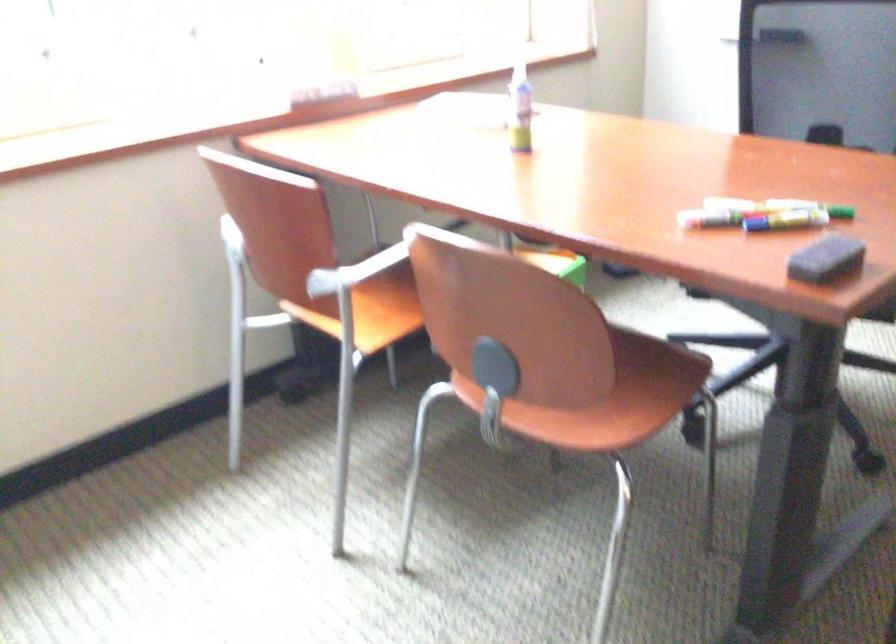
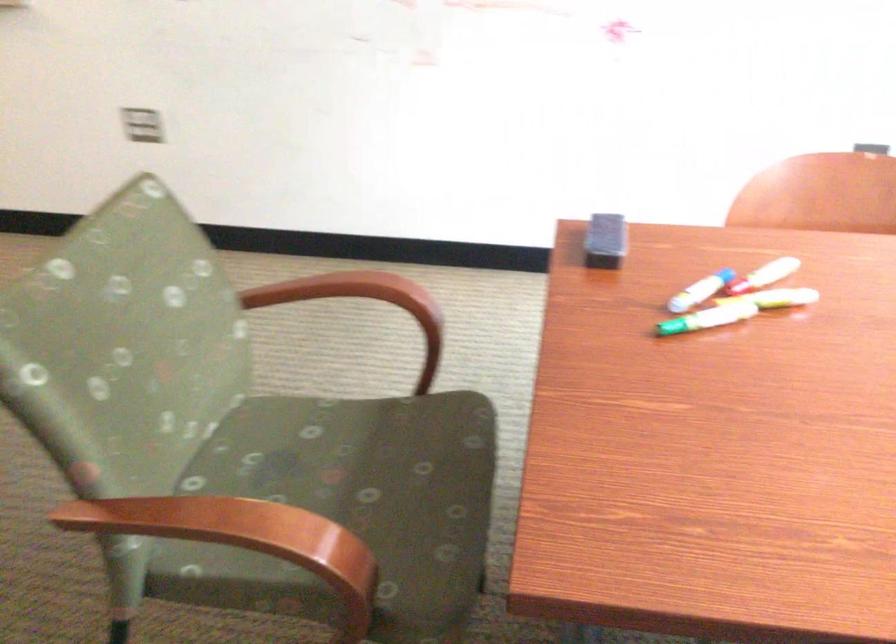
Locate, in the second image, the point that corresponds to [771,222] in the first image.

(700, 290)